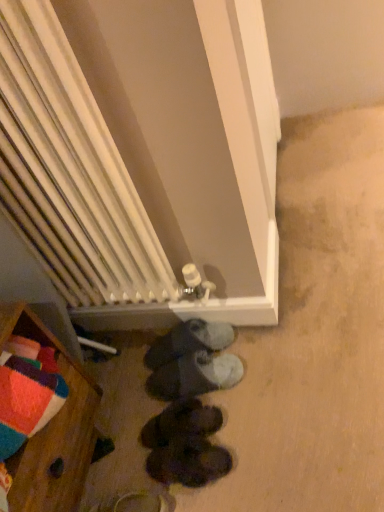
What do you see at coordinates (149, 150) in the screenshot?
I see `white radiator at center` at bounding box center [149, 150].

The image size is (384, 512). Describe the element at coordinates (195, 375) in the screenshot. I see `dark gray suede shoes at center, arranged as the third footwear when ordered from the bottom` at that location.

Identify the location of black suede shoes at lower center, the 3th footwear when ordered from top to bottom. This screenshot has height=512, width=384. (181, 423).

Image resolution: width=384 pixels, height=512 pixels. Describe the element at coordinates (188, 462) in the screenshot. I see `dark brown leather shoes at center, which ranks as the first footwear in bottom-to-top order` at that location.

The height and width of the screenshot is (512, 384). I want to click on dark brown leather shoes at center, which ranks as the first footwear in bottom-to-top order, so click(x=188, y=462).

This screenshot has width=384, height=512. Find the location of `white radiator at center`. white radiator at center is located at coordinates (149, 150).

Can you tell me how much dark brown leather shoes at center, the fourth footwear when ordered from top to bottom, and white radiator at center differ in facing direction?

The facing directions of dark brown leather shoes at center, the fourth footwear when ordered from top to bottom, and white radiator at center are 96.1 degrees apart.

Which is correct: dark brown leather shoes at center, the fourth footwear when ordered from top to bottom, is inside white radiator at center, or outside of it?

The correct answer is: outside.

Is there a large distance between dark brown leather shoes at center, the fourth footwear when ordered from top to bottom, and white radiator at center?

No, dark brown leather shoes at center, the fourth footwear when ordered from top to bottom, is in close proximity to white radiator at center.

At what (x,y) coordinates should I click in order to perform the action: click on furnurniture lying above the dark brown leather shoes at center, the fourth footwear when ordered from top to bottom (from the image's perspective). Please return your answer as a coordinate pair (x, y). The height and width of the screenshot is (512, 384). Looking at the image, I should click on (149, 150).

Is the depth of black suede shoes at lower center, marked as the 4th footwear in a bottom-to-top arrangement, less than that of dark gray suede shoes at center, placed as the second footwear when sorted from top to bottom?

No, it is not.

Visually, is black suede shoes at lower center, positioned as the 1th footwear in top-to-bottom order, positioned to the left or to the right of dark gray suede shoes at center, arranged as the third footwear when ordered from the bottom?

black suede shoes at lower center, positioned as the 1th footwear in top-to-bottom order, is to the left of dark gray suede shoes at center, arranged as the third footwear when ordered from the bottom.

From the image's perspective, would you say black suede shoes at lower center, positioned as the 1th footwear in top-to-bottom order, is shown under dark gray suede shoes at center, arranged as the third footwear when ordered from the bottom?

Incorrect, from the image's perspective, black suede shoes at lower center, positioned as the 1th footwear in top-to-bottom order, is higher than dark gray suede shoes at center, arranged as the third footwear when ordered from the bottom.

Between point (173, 331) and point (191, 359), which one is positioned behind?

Positioned behind is point (173, 331).

Is wooden chest of drawers at lower left oriented away from black suede shoes at lower center, marked as the 4th footwear in a bottom-to-top arrangement?

No, wooden chest of drawers at lower left's orientation is not away from black suede shoes at lower center, marked as the 4th footwear in a bottom-to-top arrangement.

Is black suede shoes at lower center, positioned as the 1th footwear in top-to-bottom order, completely or partially inside wooden chest of drawers at lower left?

No, black suede shoes at lower center, positioned as the 1th footwear in top-to-bottom order, is located outside of wooden chest of drawers at lower left.

Which is more to the left, wooden chest of drawers at lower left or black suede shoes at lower center, marked as the 4th footwear in a bottom-to-top arrangement?

wooden chest of drawers at lower left is more to the left.

Is dark brown leather shoes at center, the fourth footwear when ordered from top to bottom, positioned with its back to wooden chest of drawers at lower left?

Yes, dark brown leather shoes at center, the fourth footwear when ordered from top to bottom, is positioned with its back facing wooden chest of drawers at lower left.

From a real-world perspective, who is located higher, dark brown leather shoes at center, the fourth footwear when ordered from top to bottom, or wooden chest of drawers at lower left?

wooden chest of drawers at lower left.

From their relative heights in the image, would you say dark brown leather shoes at center, the fourth footwear when ordered from top to bottom, is taller or shorter than wooden chest of drawers at lower left?

Considering their sizes, dark brown leather shoes at center, the fourth footwear when ordered from top to bottom, has less height than wooden chest of drawers at lower left.

Considering the sizes of objects dark gray suede shoes at center, placed as the second footwear when sorted from top to bottom, and black suede shoes at lower center, positioned as the 1th footwear in top-to-bottom order, in the image provided, who is thinner, dark gray suede shoes at center, placed as the second footwear when sorted from top to bottom, or black suede shoes at lower center, positioned as the 1th footwear in top-to-bottom order,?

black suede shoes at lower center, positioned as the 1th footwear in top-to-bottom order.

Does point (176, 394) come in front of point (185, 342)?

Yes.

Is dark gray suede shoes at center, placed as the second footwear when sorted from top to bottom, beside black suede shoes at lower center, marked as the 4th footwear in a bottom-to-top arrangement?

Yes, dark gray suede shoes at center, placed as the second footwear when sorted from top to bottom, is beside black suede shoes at lower center, marked as the 4th footwear in a bottom-to-top arrangement.

Is dark gray suede shoes at center, arranged as the third footwear when ordered from the bottom, smaller than black suede shoes at lower center, positioned as the 1th footwear in top-to-bottom order?

Actually, dark gray suede shoes at center, arranged as the third footwear when ordered from the bottom, might be larger than black suede shoes at lower center, positioned as the 1th footwear in top-to-bottom order.

Is dark gray suede shoes at center, placed as the second footwear when sorted from top to bottom, at the right side of wooden chest of drawers at lower left?

Yes, dark gray suede shoes at center, placed as the second footwear when sorted from top to bottom, is to the right of wooden chest of drawers at lower left.

Considering the sizes of dark gray suede shoes at center, placed as the second footwear when sorted from top to bottom, and wooden chest of drawers at lower left in the image, is dark gray suede shoes at center, placed as the second footwear when sorted from top to bottom, bigger or smaller than wooden chest of drawers at lower left?

Clearly, dark gray suede shoes at center, placed as the second footwear when sorted from top to bottom, is smaller in size than wooden chest of drawers at lower left.

Is wooden chest of drawers at lower left located within dark gray suede shoes at center, arranged as the third footwear when ordered from the bottom?

That's incorrect, wooden chest of drawers at lower left is not inside dark gray suede shoes at center, arranged as the third footwear when ordered from the bottom.

Is dark gray suede shoes at center, arranged as the third footwear when ordered from the bottom, oriented away from wooden chest of drawers at lower left?

Yes, dark gray suede shoes at center, arranged as the third footwear when ordered from the bottom, is positioned with its back facing wooden chest of drawers at lower left.

Is dark brown leather shoes at center, the fourth footwear when ordered from top to bottom, positioned with its back to black suede shoes at lower center, positioned as the 1th footwear in top-to-bottom order?

dark brown leather shoes at center, the fourth footwear when ordered from top to bottom, does not have its back to black suede shoes at lower center, positioned as the 1th footwear in top-to-bottom order.

Considering the positions of point (157, 477) and point (227, 338), is point (157, 477) closer or farther from the camera than point (227, 338)?

Point (157, 477) appears to be closer to the viewer than point (227, 338).

Is dark brown leather shoes at center, which ranks as the first footwear in bottom-to-top order, far from black suede shoes at lower center, positioned as the 1th footwear in top-to-bottom order?

No, dark brown leather shoes at center, which ranks as the first footwear in bottom-to-top order, is not far from black suede shoes at lower center, positioned as the 1th footwear in top-to-bottom order.

Measure the distance between dark brown leather shoes at center, the fourth footwear when ordered from top to bottom, and black suede shoes at lower center, positioned as the 1th footwear in top-to-bottom order.

The distance of dark brown leather shoes at center, the fourth footwear when ordered from top to bottom, from black suede shoes at lower center, positioned as the 1th footwear in top-to-bottom order, is 12.71 inches.

Identify the location of furnurniture that is on the left side of dark brown leather shoes at center, which ranks as the first footwear in bottom-to-top order. (149, 150).

This screenshot has height=512, width=384. What are the coordinates of `footwear on the right of black suede shoes at lower center, positioned as the 1th footwear in top-to-bottom order` in the screenshot? It's located at (195, 375).

Based on their spatial positions, is dark gray suede shoes at center, arranged as the third footwear when ordered from the bottom, or wooden chest of drawers at lower left further from black suede shoes at lower center, positioned as the 1th footwear in top-to-bottom order?

Based on the image, wooden chest of drawers at lower left appears to be further to black suede shoes at lower center, positioned as the 1th footwear in top-to-bottom order.

When comparing their distances from black suede shoes at lower center, which appears as the 2th footwear when ordered from the bottom, does white radiator at center or wooden chest of drawers at lower left seem closer?

wooden chest of drawers at lower left.

Considering their positions, is dark brown leather shoes at center, the fourth footwear when ordered from top to bottom, positioned further to black suede shoes at lower center, marked as the 4th footwear in a bottom-to-top arrangement, than wooden chest of drawers at lower left?

wooden chest of drawers at lower left lies further to black suede shoes at lower center, marked as the 4th footwear in a bottom-to-top arrangement, than the other object.

Looking at the image, which one is located closer to black suede shoes at lower center, which appears as the 2th footwear when ordered from the bottom, black suede shoes at lower center, marked as the 4th footwear in a bottom-to-top arrangement, or wooden chest of drawers at lower left?

black suede shoes at lower center, marked as the 4th footwear in a bottom-to-top arrangement, is closer to black suede shoes at lower center, which appears as the 2th footwear when ordered from the bottom.

Looking at the image, which one is located closer to wooden chest of drawers at lower left, dark gray suede shoes at center, arranged as the third footwear when ordered from the bottom, or black suede shoes at lower center, marked as the 4th footwear in a bottom-to-top arrangement?

Based on the image, dark gray suede shoes at center, arranged as the third footwear when ordered from the bottom, appears to be nearer to wooden chest of drawers at lower left.

Based on the photo, when comparing their distances from black suede shoes at lower center, the 3th footwear when ordered from top to bottom, does dark gray suede shoes at center, placed as the second footwear when sorted from top to bottom, or black suede shoes at lower center, marked as the 4th footwear in a bottom-to-top arrangement, seem closer?

dark gray suede shoes at center, placed as the second footwear when sorted from top to bottom.

When comparing their distances from black suede shoes at lower center, the 3th footwear when ordered from top to bottom, does dark brown leather shoes at center, the fourth footwear when ordered from top to bottom, or dark gray suede shoes at center, arranged as the third footwear when ordered from the bottom, seem further?

Based on the image, dark gray suede shoes at center, arranged as the third footwear when ordered from the bottom, appears to be further to black suede shoes at lower center, the 3th footwear when ordered from top to bottom.

When comparing their distances from white radiator at center, does black suede shoes at lower center, the 3th footwear when ordered from top to bottom, or dark gray suede shoes at center, placed as the second footwear when sorted from top to bottom, seem further?

black suede shoes at lower center, the 3th footwear when ordered from top to bottom, lies further to white radiator at center than the other object.

At what (x,y) coordinates should I click in order to perform the action: click on footwear between black suede shoes at lower center, positioned as the 1th footwear in top-to-bottom order, and black suede shoes at lower center, the 3th footwear when ordered from top to bottom, in the vertical direction. Please return your answer as a coordinate pair (x, y). The width and height of the screenshot is (384, 512). Looking at the image, I should click on (195, 375).

Identify the location of footwear between dark gray suede shoes at center, arranged as the third footwear when ordered from the bottom, and dark brown leather shoes at center, which ranks as the first footwear in bottom-to-top order, in the up-down direction. The width and height of the screenshot is (384, 512). (181, 423).

I want to click on footwear situated between wooden chest of drawers at lower left and dark brown leather shoes at center, which ranks as the first footwear in bottom-to-top order, from left to right, so (181, 423).

Where is `furniture between white radiator at center and dark brown leather shoes at center, the fourth footwear when ordered from top to bottom, vertically`? furniture between white radiator at center and dark brown leather shoes at center, the fourth footwear when ordered from top to bottom, vertically is located at coordinates (53, 428).